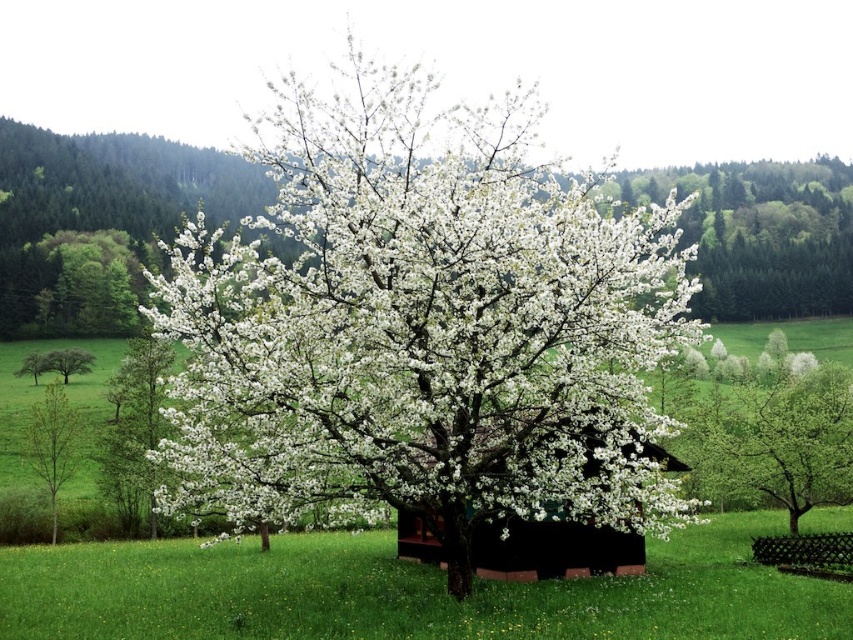
You are planning to plant a new tree in your garden. You have two options from the image shown. Which tree, the white matte tree at center or the green matte tree at left, would take up more space horizontally in your garden?

The white matte tree at center has a larger width than the green matte tree at left, so it would take up more horizontal space in your garden.

You are standing in the meadow and want to walk from the black wood hut at center to the green matte tree at left. Which direction should you head towards?

The black wood hut at center is closer to the viewer than the green matte tree at left, so you should head towards the left to reach the green matte tree at left.

You are standing in the meadow and want to take a photo of both the white matte tree at center and the green matte tree at left. Which tree should you focus on first to ensure both are in the frame?

You should focus on the white matte tree at center first because it is closer to the viewer than the green matte tree at left, so adjusting the camera to include both would require starting with the closer one.